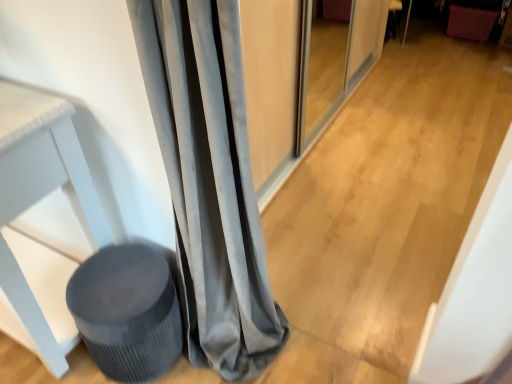
Where is `velvet gray curtain at left`? velvet gray curtain at left is located at coordinates (210, 181).

In order to face velvet burgundy swivel chair at upper right, should I rotate leftwards or rightwards?

You should look right and rotate roughly 27.375 degrees.

Find the location of a particular element. velvet burgundy swivel chair at upper right is located at coordinates (472, 19).

This screenshot has height=384, width=512. Describe the element at coordinates (127, 312) in the screenshot. I see `matte gray stool at lower left` at that location.

Describe the element at coordinates (300, 76) in the screenshot. I see `matte gray screen door at center` at that location.

At what (x,y) coordinates should I click in order to perform the action: click on velvet gray curtain at left. Please return your answer as a coordinate pair (x, y). Image resolution: width=512 pixels, height=384 pixels. Looking at the image, I should click on (210, 181).

Does matte gray stool at lower left touch velvet gray curtain at left?

No, matte gray stool at lower left is not next to velvet gray curtain at left.

Does matte gray stool at lower left turn towards velvet gray curtain at left?

No, matte gray stool at lower left is not facing towards velvet gray curtain at left.

Considering the relative sizes of matte gray stool at lower left and velvet gray curtain at left in the image provided, is matte gray stool at lower left shorter than velvet gray curtain at left?

Yes.

Considering the sizes of objects velvet burgundy swivel chair at upper right and velvet gray curtain at left in the image provided, who is wider, velvet burgundy swivel chair at upper right or velvet gray curtain at left?

velvet burgundy swivel chair at upper right is wider.

Locate an element on the screen. curtain lying in front of the velvet burgundy swivel chair at upper right is located at coordinates (210, 181).

From a real-world perspective, who is located higher, velvet burgundy swivel chair at upper right or velvet gray curtain at left?

In real-world perspective, velvet gray curtain at left is above.

Is point (458, 36) farther from viewer compared to point (221, 203)?

Yes, it is behind point (221, 203).

Is matte gray screen door at center beside velvet burgundy swivel chair at upper right?

matte gray screen door at center and velvet burgundy swivel chair at upper right are clearly separated.

How many degrees apart are the facing directions of matte gray screen door at center and velvet burgundy swivel chair at upper right?

98.2 degrees.

From a real-world perspective, who is located higher, matte gray screen door at center or velvet burgundy swivel chair at upper right?

matte gray screen door at center.

Consider the image. From the image's perspective, between matte gray screen door at center and velvet burgundy swivel chair at upper right, who is located below?

matte gray screen door at center appears lower in the image.

From a real-world perspective, is velvet gray curtain at left physically located above or below velvet burgundy swivel chair at upper right?

In terms of real-world spatial position, velvet gray curtain at left is above velvet burgundy swivel chair at upper right.

Which of these two, velvet gray curtain at left or velvet burgundy swivel chair at upper right, is wider?

velvet burgundy swivel chair at upper right is wider.

Can you tell me how much velvet gray curtain at left and velvet burgundy swivel chair at upper right differ in facing direction?

They differ by 8.35 degrees in their facing directions.

Between velvet burgundy swivel chair at upper right and matte gray stool at lower left, which one has larger width?

Wider between the two is velvet burgundy swivel chair at upper right.

Looking at the image, does velvet burgundy swivel chair at upper right seem bigger or smaller compared to matte gray stool at lower left?

Considering their sizes, velvet burgundy swivel chair at upper right takes up more space than matte gray stool at lower left.

Is velvet burgundy swivel chair at upper right looking in the opposite direction of matte gray stool at lower left?

velvet burgundy swivel chair at upper right does not have its back to matte gray stool at lower left.

From a real-world perspective, is velvet burgundy swivel chair at upper right on matte gray stool at lower left?

Incorrect, from a real-world perspective, velvet burgundy swivel chair at upper right is lower than matte gray stool at lower left.

Looking at this image, is matte gray stool at lower left bigger than velvet burgundy swivel chair at upper right?

Incorrect, matte gray stool at lower left is not larger than velvet burgundy swivel chair at upper right.

Locate an element on the screen. swivel chair above the matte gray stool at lower left (from the image's perspective) is located at coordinates (472, 19).

From a real-world perspective, between matte gray stool at lower left and velvet burgundy swivel chair at upper right, who is vertically higher?

matte gray stool at lower left.

Is matte gray screen door at center oriented away from matte gray stool at lower left?

No, matte gray screen door at center is not facing away from matte gray stool at lower left.

Are matte gray screen door at center and matte gray stool at lower left far apart?

Yes, matte gray screen door at center is far from matte gray stool at lower left.

Does matte gray screen door at center have a smaller size compared to matte gray stool at lower left?

No, matte gray screen door at center is not smaller than matte gray stool at lower left.

Considering the points (269, 7) and (158, 321), which point is in front, point (269, 7) or point (158, 321)?

Point (158, 321)

Image resolution: width=512 pixels, height=384 pixels. Identify the location of music stool on the left of velvet gray curtain at left. (127, 312).

Identify the location of swivel chair above the velvet gray curtain at left (from the image's perspective). The image size is (512, 384). (472, 19).

Considering their positions, is velvet burgundy swivel chair at upper right positioned further to velvet gray curtain at left than matte gray screen door at center?

Based on the image, velvet burgundy swivel chair at upper right appears to be further to velvet gray curtain at left.

Which object lies further to the anchor point velvet gray curtain at left, velvet burgundy swivel chair at upper right or matte gray stool at lower left?

Based on the image, velvet burgundy swivel chair at upper right appears to be further to velvet gray curtain at left.

Based on the photo, considering their positions, is velvet gray curtain at left positioned further to matte gray stool at lower left than velvet burgundy swivel chair at upper right?

velvet burgundy swivel chair at upper right is positioned further to the anchor matte gray stool at lower left.

When comparing their distances from matte gray screen door at center, does velvet burgundy swivel chair at upper right or matte gray stool at lower left seem closer?

Based on the image, matte gray stool at lower left appears to be nearer to matte gray screen door at center.

When comparing their distances from matte gray screen door at center, does velvet burgundy swivel chair at upper right or velvet gray curtain at left seem further?

Based on the image, velvet burgundy swivel chair at upper right appears to be further to matte gray screen door at center.

From the image, which object appears to be farther from velvet burgundy swivel chair at upper right, velvet gray curtain at left or matte gray screen door at center?

velvet gray curtain at left.

From the image, which object appears to be nearer to velvet gray curtain at left, matte gray screen door at center or velvet burgundy swivel chair at upper right?

The object closer to velvet gray curtain at left is matte gray screen door at center.

When comparing their distances from matte gray screen door at center, does matte gray stool at lower left or velvet burgundy swivel chair at upper right seem closer?

matte gray stool at lower left is positioned closer to the anchor matte gray screen door at center.

Identify the location of music stool between velvet gray curtain at left and velvet burgundy swivel chair at upper right from front to back. (127, 312).

In order to click on screen door located between velvet gray curtain at left and velvet burgundy swivel chair at upper right in the depth direction in this screenshot , I will do `click(300, 76)`.

The image size is (512, 384). In order to click on screen door located between matte gray stool at lower left and velvet burgundy swivel chair at upper right in the depth direction in this screenshot , I will do `click(300, 76)`.

Where is `curtain that lies between matte gray screen door at center and matte gray stool at lower left from top to bottom`? The width and height of the screenshot is (512, 384). curtain that lies between matte gray screen door at center and matte gray stool at lower left from top to bottom is located at coordinates (210, 181).